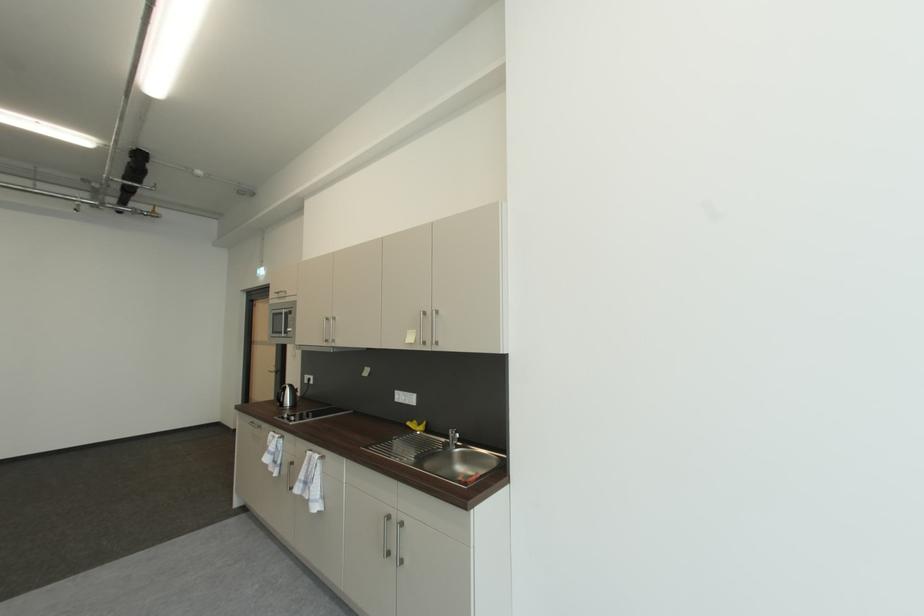
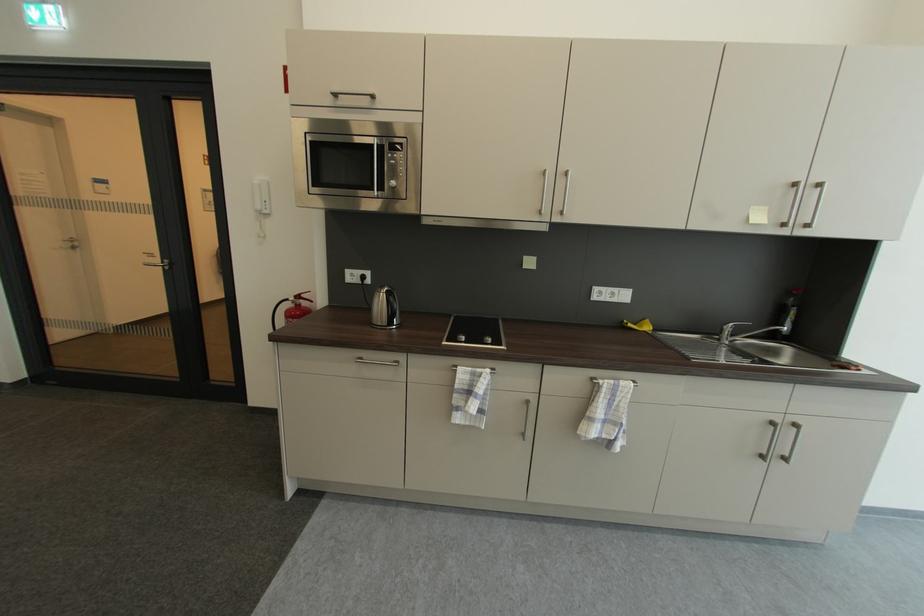
In the second image, find the point that corresponds to (x=282, y=294) in the first image.

(337, 95)